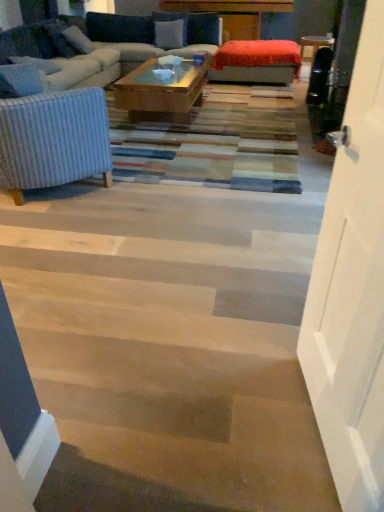
Question: Is white wood door at right facing towards velvet blue pillow at upper center, the second pillow viewed from the top?

Choices:
 (A) no
 (B) yes

Answer: (A)

Question: Can you confirm if white wood door at right is positioned to the right of velvet blue pillow at upper center, the 3th pillow ordered from the bottom?

Choices:
 (A) no
 (B) yes

Answer: (B)

Question: Is white wood door at right closer to camera compared to velvet blue pillow at upper center, acting as the 3th pillow starting from the front?

Choices:
 (A) yes
 (B) no

Answer: (A)

Question: Is white wood door at right with velvet blue pillow at upper center, the 3th pillow ordered from the bottom?

Choices:
 (A) no
 (B) yes

Answer: (A)

Question: From a real-world perspective, is white wood door at right positioned under velvet blue pillow at upper center, acting as the second pillow starting from the back, based on gravity?

Choices:
 (A) no
 (B) yes

Answer: (A)

Question: Is velvet blue couch at upper left spatially inside white wood door at right, or outside of it?

Choices:
 (A) outside
 (B) inside

Answer: (A)

Question: Is velvet blue couch at upper left bigger or smaller than white wood door at right?

Choices:
 (A) big
 (B) small

Answer: (A)

Question: Is point (109, 28) positioned closer to the camera than point (324, 339)?

Choices:
 (A) farther
 (B) closer

Answer: (A)

Question: From their relative heights in the image, would you say velvet blue couch at upper left is taller or shorter than white wood door at right?

Choices:
 (A) tall
 (B) short

Answer: (B)

Question: Is velvet orange ottoman at center situated inside velvet blue couch at upper left or outside?

Choices:
 (A) inside
 (B) outside

Answer: (B)

Question: In terms of width, does velvet orange ottoman at center look wider or thinner when compared to velvet blue couch at upper left?

Choices:
 (A) wide
 (B) thin

Answer: (B)

Question: Considering the positions of velvet orange ottoman at center and velvet blue couch at upper left in the image, is velvet orange ottoman at center taller or shorter than velvet blue couch at upper left?

Choices:
 (A) tall
 (B) short

Answer: (B)

Question: Based on their positions, is velvet orange ottoman at center located to the left or right of velvet blue couch at upper left?

Choices:
 (A) left
 (B) right

Answer: (B)

Question: Considering the positions of velvet blue pillow at upper center, the second pillow viewed from the top, and white fabric pillow at upper left, acting as the third pillow starting from the top, in the image, is velvet blue pillow at upper center, the second pillow viewed from the top, bigger or smaller than white fabric pillow at upper left, acting as the third pillow starting from the top,?

Choices:
 (A) small
 (B) big

Answer: (B)

Question: Relative to white fabric pillow at upper left, acting as the third pillow starting from the top, is velvet blue pillow at upper center, acting as the second pillow starting from the back, in front or behind?

Choices:
 (A) behind
 (B) front

Answer: (A)